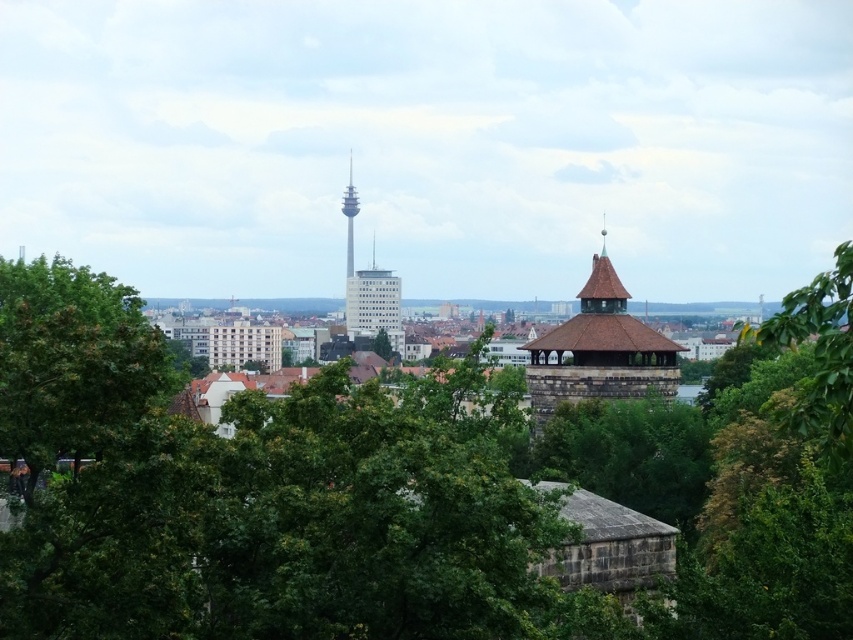
Between green leafy tree at left and brown wooden tower at center, which one is positioned higher?

green leafy tree at left is above.

Does point (30, 371) lie in front of point (535, 340)?

Yes, it is in front of point (535, 340).

I want to click on green leafy tree at left, so click(73, 364).

Is brown wooden tower at center in front of white glass building at center?

Yes, brown wooden tower at center is closer to the viewer.

Is brown wooden tower at center shorter than white glass building at center?

Correct, brown wooden tower at center is not as tall as white glass building at center.

Who is more forward, (x=535, y=403) or (x=392, y=346)?

Point (x=535, y=403)

I want to click on brown wooden tower at center, so click(599, 349).

Does green leafy tree at left appear on the left side of green leafy tree at right?

Correct, you'll find green leafy tree at left to the left of green leafy tree at right.

Which is above, green leafy tree at left or green leafy tree at right?

green leafy tree at left is higher up.

Who is more forward, (39, 272) or (793, 332)?

Point (793, 332)

Find the location of `green leafy tree at left`. green leafy tree at left is located at coordinates (73, 364).